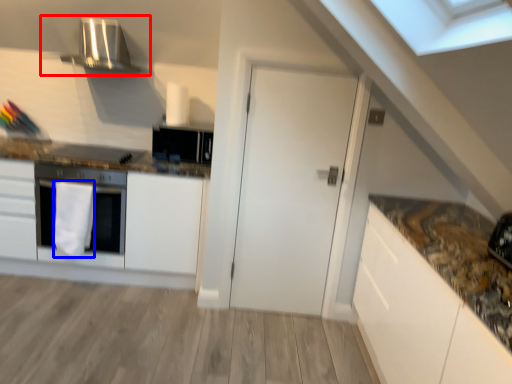
Question: Among these objects, which one is farthest to the camera, exhaust hood (highlighted by a red box) or material (highlighted by a blue box)?

Choices:
 (A) exhaust hood
 (B) material

Answer: (A)